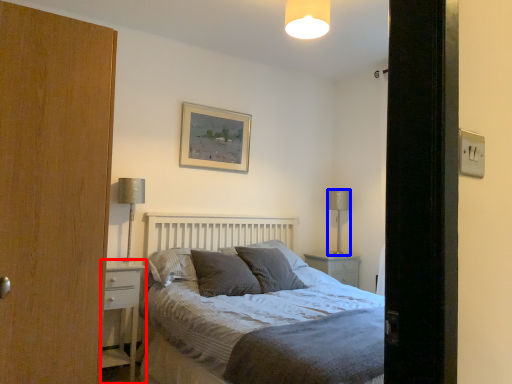
Question: Which object is closer to the camera taking this photo, nightstand (highlighted by a red box) or table lamp (highlighted by a blue box)?

Choices:
 (A) nightstand
 (B) table lamp

Answer: (A)